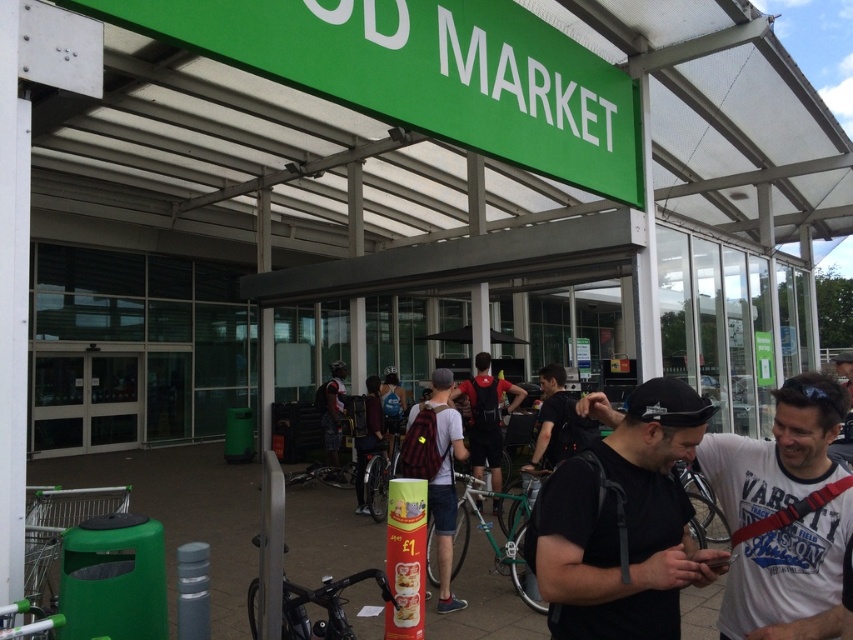
Does red fabric backpack at center have a larger size compared to camouflage-patterned shorts at center?

Yes, red fabric backpack at center is bigger than camouflage-patterned shorts at center.

Is red fabric backpack at center shorter than camouflage-patterned shorts at center?

In fact, red fabric backpack at center may be taller than camouflage-patterned shorts at center.

The height and width of the screenshot is (640, 853). In order to click on red fabric backpack at center in this screenshot , I will do `click(486, 417)`.

Is green plastic sign at upper center shorter than red fabric backpack at center?

Indeed, green plastic sign at upper center has a lesser height compared to red fabric backpack at center.

Which of these two, green plastic sign at upper center or red fabric backpack at center, stands shorter?

With less height is green plastic sign at upper center.

Measure the distance between green plastic sign at upper center and camera.

green plastic sign at upper center and camera are 3.09 meters apart from each other.

At what (x,y) coordinates should I click in order to perform the action: click on green plastic sign at upper center. Please return your answer as a coordinate pair (x, y). Looking at the image, I should click on (426, 74).

Is green plastic sign at upper center shorter than white cotton t-shirt at lower right?

No, green plastic sign at upper center is not shorter than white cotton t-shirt at lower right.

What do you see at coordinates (426, 74) in the screenshot?
I see `green plastic sign at upper center` at bounding box center [426, 74].

Where is `green plastic sign at upper center`? green plastic sign at upper center is located at coordinates (426, 74).